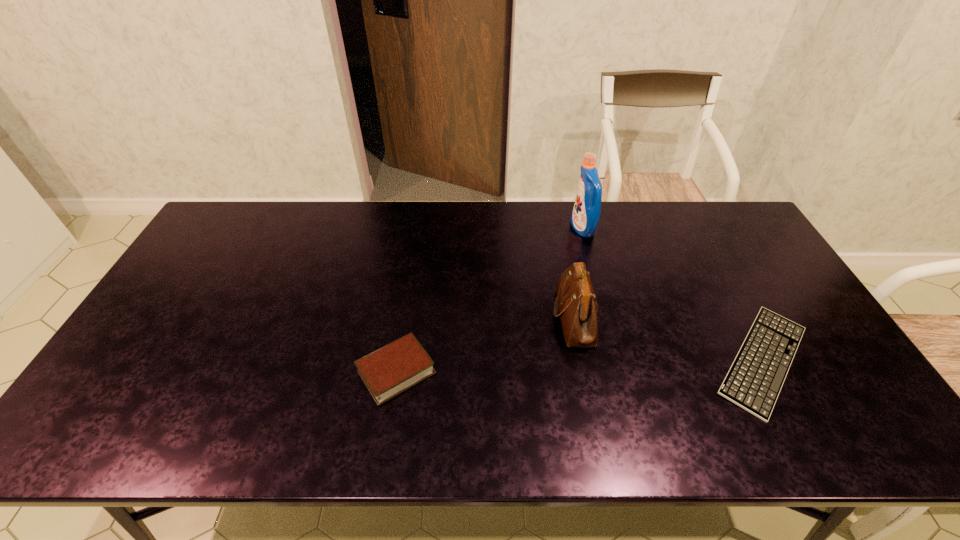
The height and width of the screenshot is (540, 960). I want to click on vacant space at the right edge of the desktop, so click(x=750, y=259).

Where is `blank area at the far left corner`? This screenshot has height=540, width=960. blank area at the far left corner is located at coordinates (257, 218).

Find the location of `free region at the far right corner of the desktop`. free region at the far right corner of the desktop is located at coordinates (708, 226).

Where is `vacant point located between the detergent and the computer keyboard`? The image size is (960, 540). vacant point located between the detergent and the computer keyboard is located at coordinates (673, 294).

You are a GUI agent. You are given a task and a screenshot of the screen. Output one action in this format:
    pyautogui.click(x=<x>, y=<y>)
    Task: Click on the free spot between the shortest object and the farthest object
    The image size is (960, 540).
    Given the screenshot: What is the action you would take?
    pyautogui.click(x=673, y=294)

Locate an element on the screen. This screenshot has height=540, width=960. vacant area between the third tallest object and the shoulder bag is located at coordinates (486, 344).

Locate an element on the screen. free spot between the rightmost object and the second tallest object is located at coordinates (669, 338).

This screenshot has width=960, height=540. In order to click on free space between the shortest object and the detergent in this screenshot , I will do `click(673, 294)`.

Identify the location of empty location between the shoulder bag and the computer keyboard. (669, 338).

Locate an element on the screen. The height and width of the screenshot is (540, 960). vacant space in between the Bible and the tallest object is located at coordinates (490, 300).